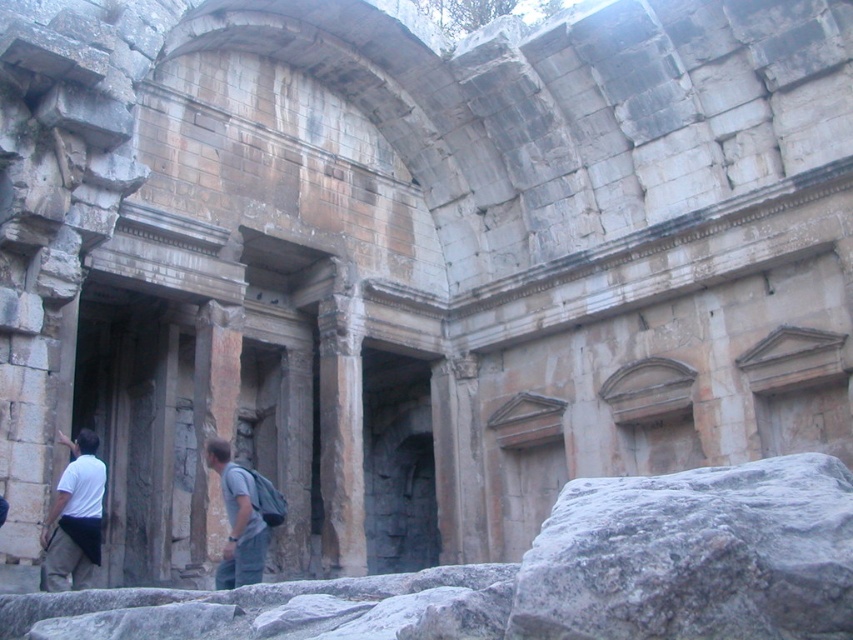
You are standing in front of the ancient stone structure and want to touch both points mentioned. Which point should you reach for first, the point at coordinate (71, 460) or the point at coordinate (260, 556)?

You should reach for point (71, 460) first because it is closer to you than point (260, 556), which is further away.

You are a hiker who has just arrived at this ancient stone structure. You notice a gray stone boulder at lower right and a white fabric backpack at lower left. Which object is positioned higher from the ground?

The gray stone boulder at lower right is above the white fabric backpack at lower left, so the gray stone boulder at lower right is positioned higher from the ground.